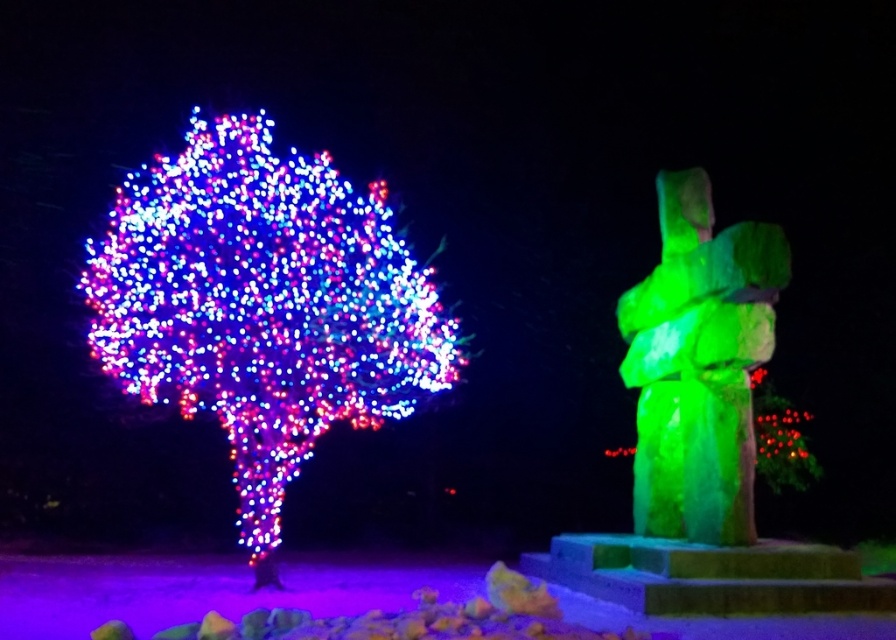
Question: Observing the image, what is the correct spatial positioning of illuminated plastic tree at left in reference to green stone statue at right?

Choices:
 (A) below
 (B) above

Answer: (B)

Question: Can you confirm if illuminated plastic tree at left is thinner than green stone statue at right?

Choices:
 (A) no
 (B) yes

Answer: (A)

Question: Can you confirm if illuminated plastic tree at left is positioned to the left of green stone statue at right?

Choices:
 (A) no
 (B) yes

Answer: (B)